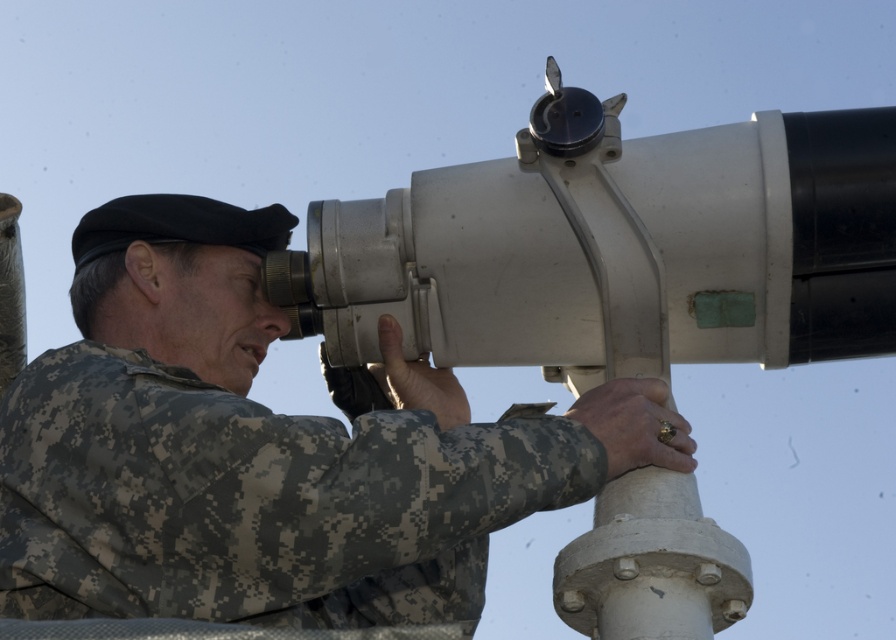
Which of these two, matte gray binoculars at center or metallic/smooth telescope at upper center, stands taller?

With more height is metallic/smooth telescope at upper center.

Can you confirm if matte gray binoculars at center is positioned to the right of metallic/smooth telescope at upper center?

Incorrect, matte gray binoculars at center is not on the right side of metallic/smooth telescope at upper center.

Is point (287, 566) less distant than point (785, 193)?

Yes, point (287, 566) is closer to viewer.

Locate an element on the screen. This screenshot has height=640, width=896. matte gray binoculars at center is located at coordinates (265, 451).